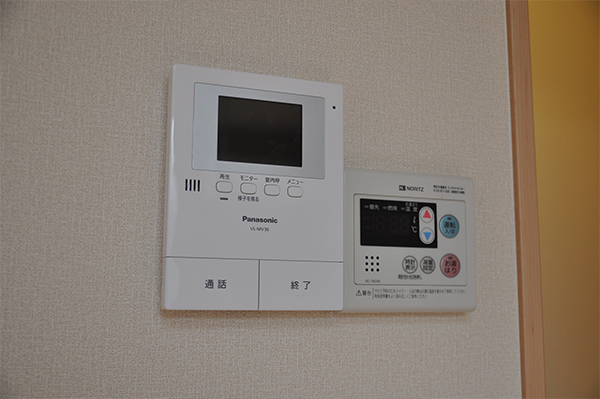
This screenshot has height=399, width=600. I want to click on divider, so click(x=521, y=177).